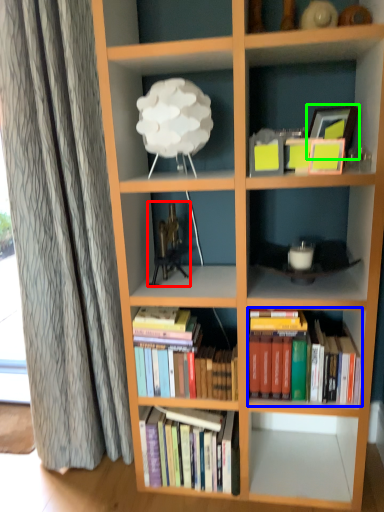
Question: Which object is positioned farthest from toy (highlighted by a red box)? Select from book (highlighted by a blue box) and picture frame (highlighted by a green box).

Choices:
 (A) book
 (B) picture frame

Answer: (B)